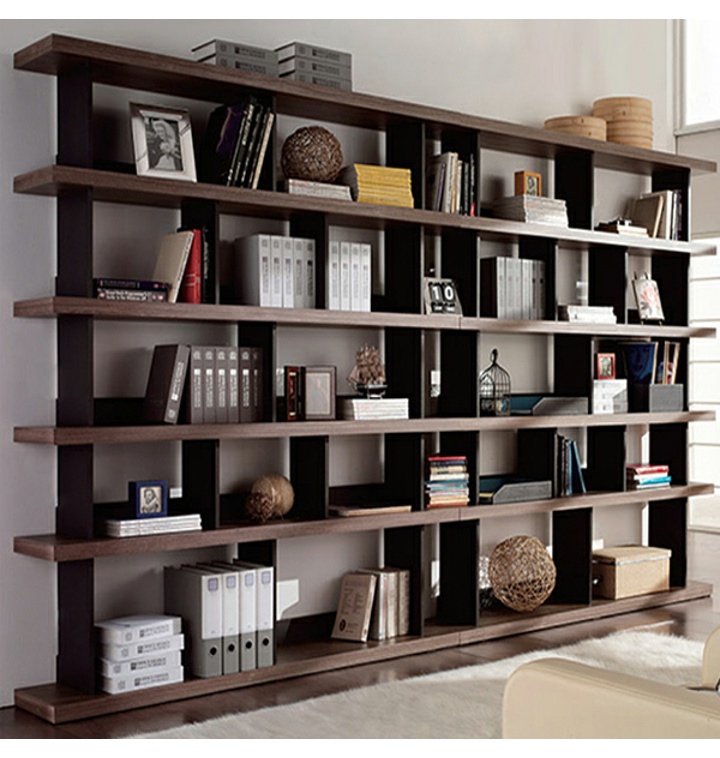
Find the location of a particular element. framed pictures is located at coordinates (156, 146), (528, 180), (292, 390), (315, 387), (603, 362), (150, 495).